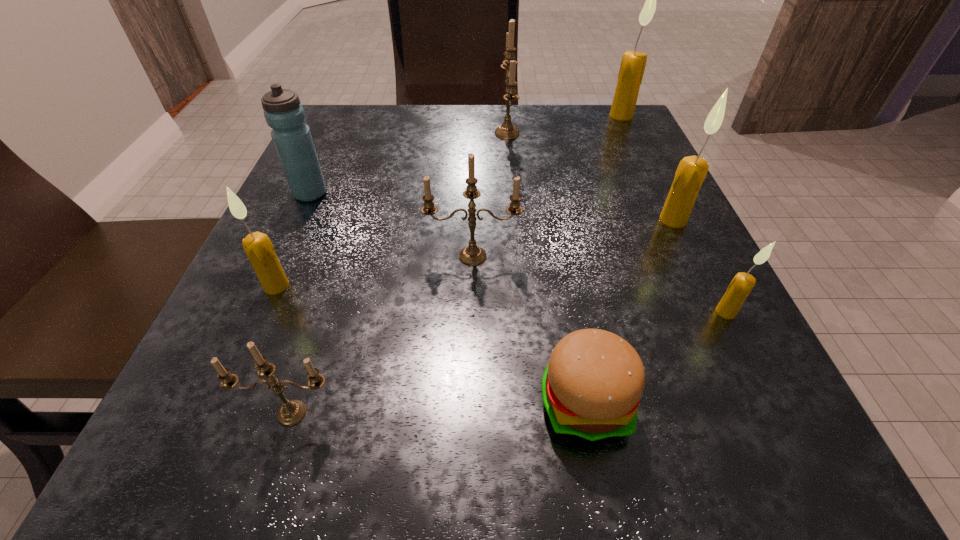
Where is `vacant area at the far edge of the desktop`? vacant area at the far edge of the desktop is located at coordinates (484, 158).

This screenshot has width=960, height=540. In the image, there is a desktop. In order to click on free space at the near edge in this screenshot , I will do `click(489, 485)`.

This screenshot has width=960, height=540. What are the coordinates of `vacant region at the left edge` in the screenshot? It's located at (351, 258).

Locate an element on the screen. The image size is (960, 540). vacant region at the right edge of the desktop is located at coordinates (628, 206).

Identify the location of free space at the far right corner of the desktop. The height and width of the screenshot is (540, 960). (563, 117).

You are a GUI agent. You are given a task and a screenshot of the screen. Output one action in this format:
    pyautogui.click(x=<x>, y=<y>)
    Task: Click on the vacant space at the near right corner of the desktop
    
    Given the screenshot: What is the action you would take?
    pyautogui.click(x=742, y=434)

The image size is (960, 540). Identify the location of free point between the seventh object from right to left and the seventh nearest object. click(x=301, y=303).

You are a GUI agent. You are given a task and a screenshot of the screen. Output one action in this format:
    pyautogui.click(x=<x>, y=<y>)
    Task: Click on the blank region between the seventh nearest object and the biggest cream candle
    
    Given the screenshot: What is the action you would take?
    pyautogui.click(x=466, y=154)

Find the location of a particular element. free space between the leftmost candle and the nearest cream candle is located at coordinates (501, 299).

I want to click on vacant area that lies between the seventh nearest object and the third nearest object, so click(518, 253).